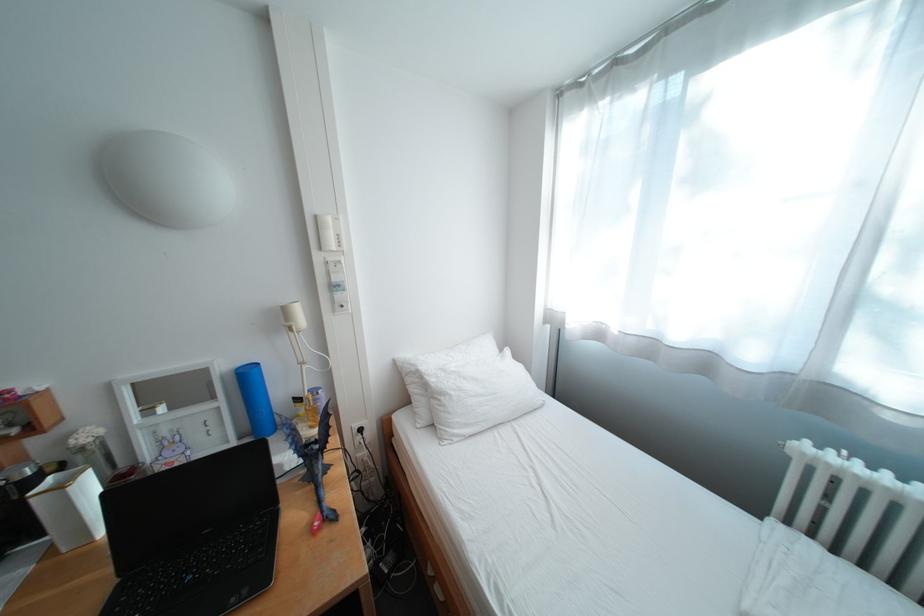
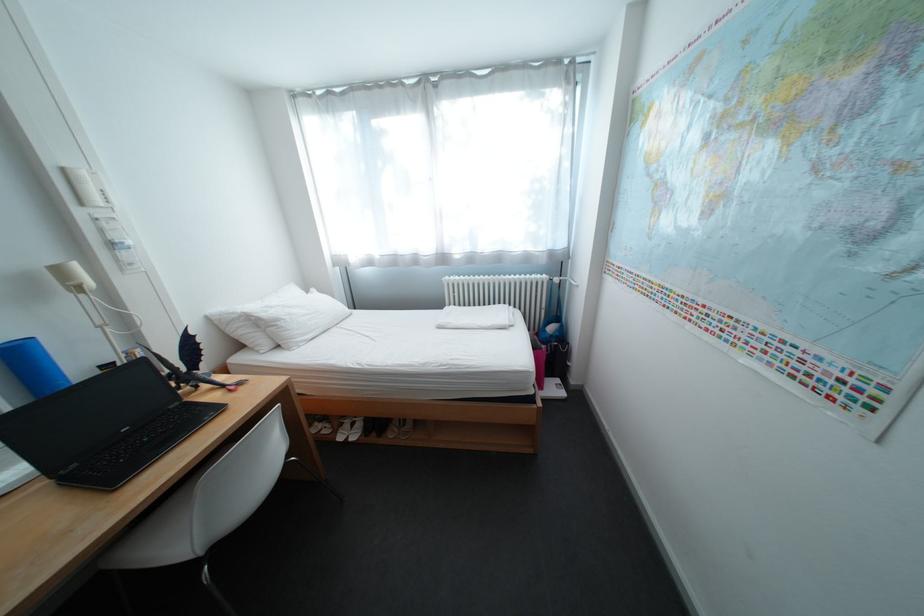
In the second image, find the point that corresponds to [216,533] in the first image.

(137, 431)